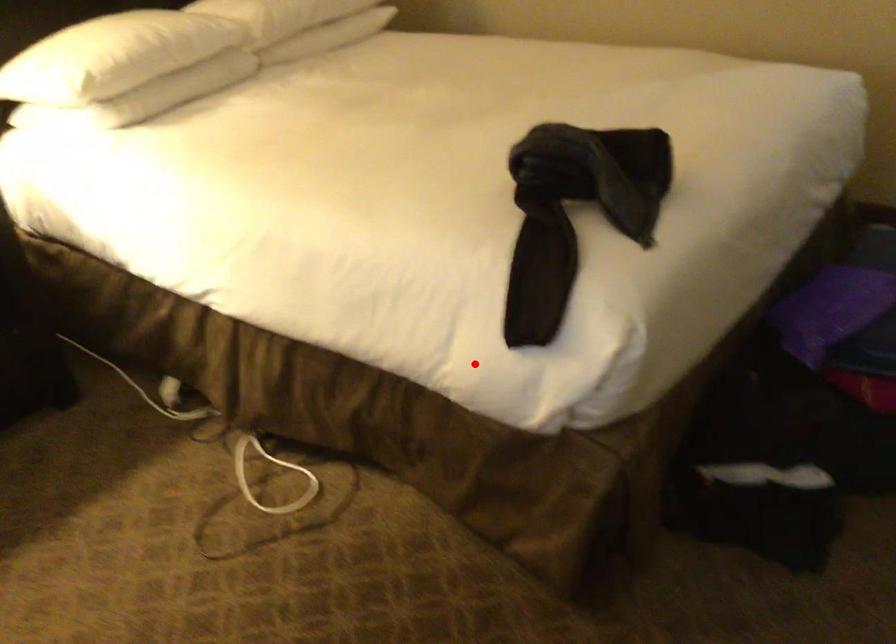
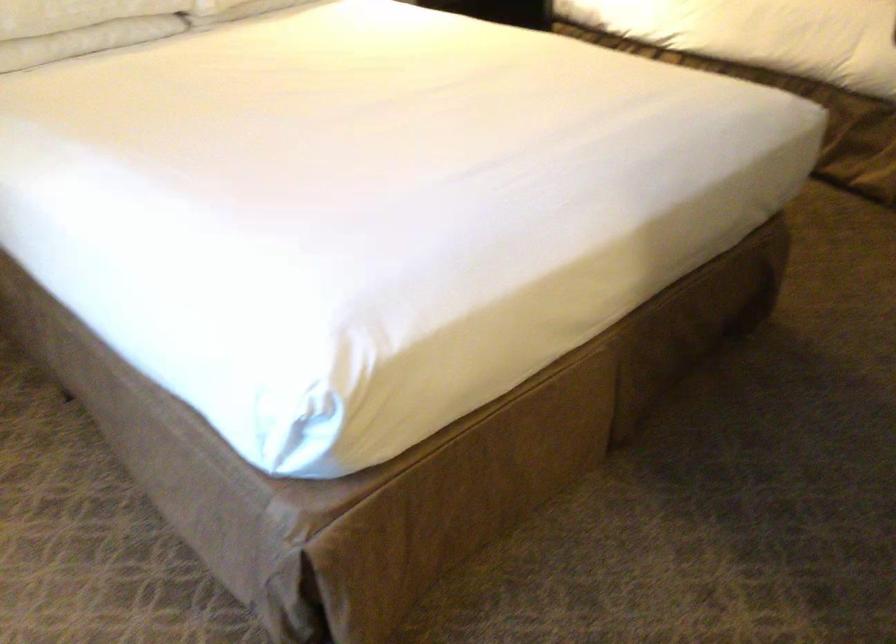
Question: I am providing you with two images of the same scene from different viewpoints. A red point is marked on the first image. At the location where the point appears in image 1, is it still visible in image 2?

Choices:
 (A) Yes
 (B) No

Answer: (A)